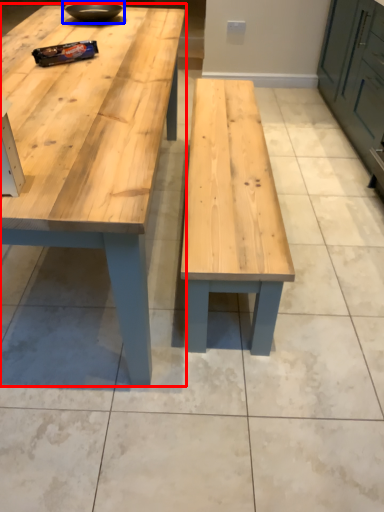
Question: Which point is further to the camera, table (highlighted by a red box) or bowl (highlighted by a blue box)?

Choices:
 (A) table
 (B) bowl

Answer: (B)